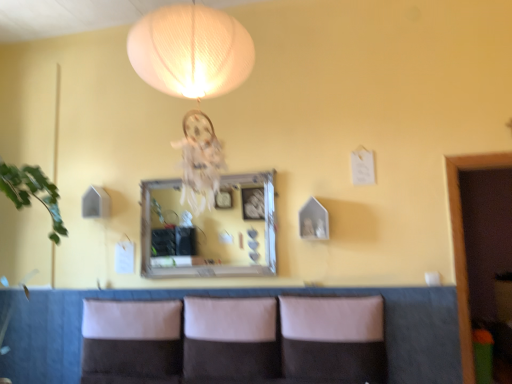
Question: Can you confirm if leather-like brown couch at lower center is positioned to the left of leather-like beige pillow at center, the 1th pillow from the right?

Choices:
 (A) no
 (B) yes

Answer: (B)

Question: Can you confirm if leather-like brown couch at lower center is smaller than leather-like beige pillow at center, which is the 3th pillow from left to right?

Choices:
 (A) no
 (B) yes

Answer: (A)

Question: Can you confirm if leather-like brown couch at lower center is shorter than leather-like beige pillow at center, the 1th pillow from the right?

Choices:
 (A) no
 (B) yes

Answer: (A)

Question: Does leather-like brown couch at lower center have a larger size compared to leather-like beige pillow at center, the 1th pillow from the right?

Choices:
 (A) yes
 (B) no

Answer: (A)

Question: Does leather-like brown couch at lower center have a lesser width compared to leather-like beige pillow at center, which is the 3th pillow from left to right?

Choices:
 (A) no
 (B) yes

Answer: (B)

Question: Is point (94, 379) positioned closer to the camera than point (245, 339)?

Choices:
 (A) closer
 (B) farther

Answer: (B)

Question: Is white fabric pillow at lower center, which is the first pillow in left-to-right order, to the left or to the right of suede-like beige pillow at center, which appears as the second pillow when viewed from the left, in the image?

Choices:
 (A) right
 (B) left

Answer: (B)

Question: In terms of height, does white fabric pillow at lower center, which is counted as the 3th pillow, starting from the right, look taller or shorter compared to suede-like beige pillow at center, the 2th pillow positioned from the right?

Choices:
 (A) tall
 (B) short

Answer: (B)

Question: Based on their sizes in the image, would you say white fabric pillow at lower center, which is the first pillow in left-to-right order, is bigger or smaller than suede-like beige pillow at center, which appears as the second pillow when viewed from the left?

Choices:
 (A) small
 (B) big

Answer: (A)

Question: In terms of size, does suede-like beige pillow at center, which appears as the second pillow when viewed from the left, appear bigger or smaller than leather-like brown couch at lower center?

Choices:
 (A) big
 (B) small

Answer: (B)

Question: Is point (197, 357) closer or farther from the camera than point (311, 294)?

Choices:
 (A) closer
 (B) farther

Answer: (A)

Question: Based on their positions, is suede-like beige pillow at center, the 2th pillow positioned from the right, located to the left or right of leather-like brown couch at lower center?

Choices:
 (A) left
 (B) right

Answer: (A)

Question: From the image's perspective, is suede-like beige pillow at center, which appears as the second pillow when viewed from the left, located above or below leather-like brown couch at lower center?

Choices:
 (A) above
 (B) below

Answer: (A)

Question: Is leather-like brown couch at lower center wider or thinner than white fabric pillow at lower center, which is counted as the 3th pillow, starting from the right?

Choices:
 (A) wide
 (B) thin

Answer: (B)

Question: From a real-world perspective, is leather-like brown couch at lower center physically located above or below white fabric pillow at lower center, which is the first pillow in left-to-right order?

Choices:
 (A) below
 (B) above

Answer: (A)